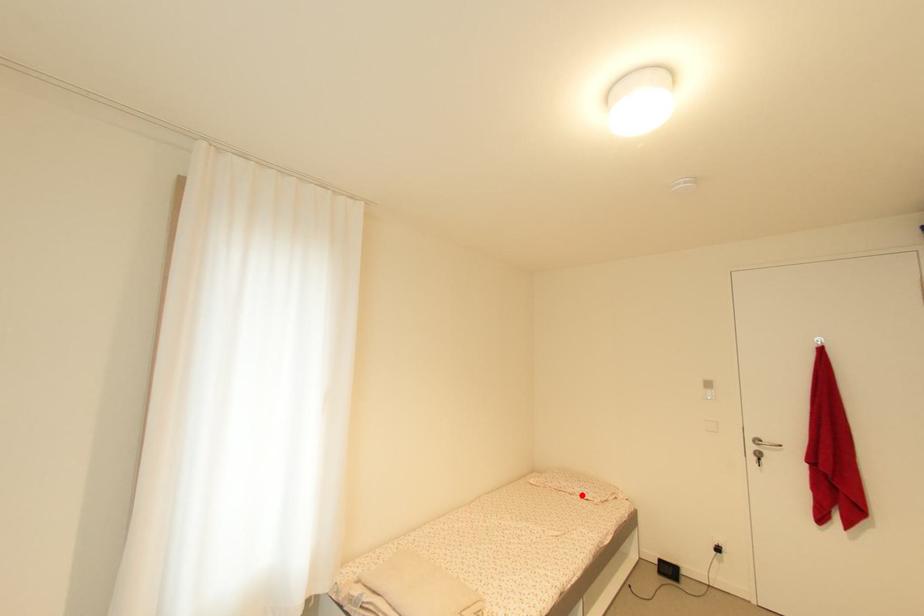
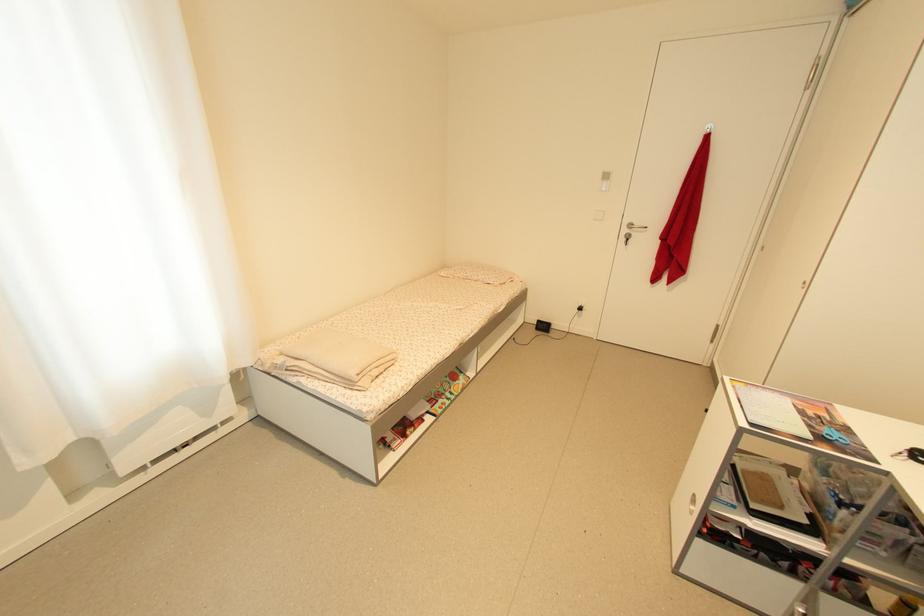
Locate, in the second image, the point that corresponds to the highlighted location in the first image.

(485, 282)